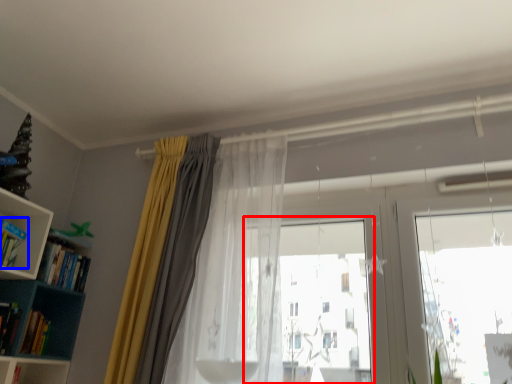
Question: Which point is closer to the camera, bay window (highlighted by a red box) or book (highlighted by a blue box)?

Choices:
 (A) bay window
 (B) book

Answer: (A)